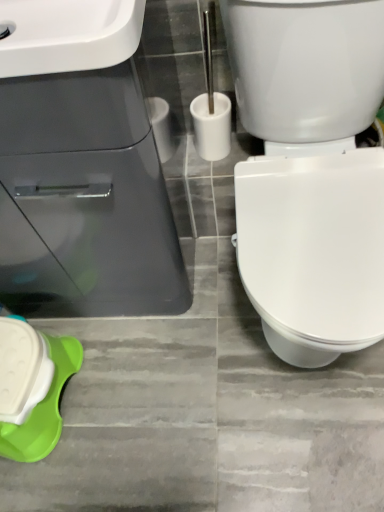
How much space does white glossy sink at upper left, which appears as the 2th sink when viewed from the front, occupy horizontally?

43.48 centimeters.

I want to click on green plastic container at lower left, so click(x=32, y=388).

This screenshot has height=512, width=384. Describe the element at coordinates (313, 251) in the screenshot. I see `white glossy bidet at right` at that location.

The height and width of the screenshot is (512, 384). Identify the location of white glossy bidet at right. (313, 251).

Find the location of `white glossy sink at upper left, which is counted as the 1th sink, starting from the front`. white glossy sink at upper left, which is counted as the 1th sink, starting from the front is located at coordinates (67, 35).

How much distance is there between white plastic toilet brush at center and green plastic container at lower left?

They are 29.18 inches apart.

Is white plastic toilet brush at center positioned far away from green plastic container at lower left?

white plastic toilet brush at center is near green plastic container at lower left, not far away.

Can you tell me how much white plastic toilet brush at center and green plastic container at lower left differ in facing direction?

3.7 degrees separate the facing orientations of white plastic toilet brush at center and green plastic container at lower left.

Which object is wider, white plastic toilet brush at center or green plastic container at lower left?

Wider between the two is green plastic container at lower left.

Is white glossy sink at upper left, the second sink positioned from the back, far from white glossy sink at upper left, which appears as the 2th sink when viewed from the front?

That's not correct — white glossy sink at upper left, the second sink positioned from the back, is a little close to white glossy sink at upper left, which appears as the 2th sink when viewed from the front.

Considering the relative sizes of white glossy sink at upper left, the second sink positioned from the back, and white glossy sink at upper left, which appears as the 2th sink when viewed from the front, in the image provided, is white glossy sink at upper left, the second sink positioned from the back, bigger than white glossy sink at upper left, which appears as the 2th sink when viewed from the front,?

No, white glossy sink at upper left, the second sink positioned from the back, is not bigger than white glossy sink at upper left, which appears as the 2th sink when viewed from the front.

Is white glossy sink at upper left, which is counted as the 1th sink, starting from the front, outside of white glossy sink at upper left, which appears as the 2th sink when viewed from the front?

No, white glossy sink at upper left, which is counted as the 1th sink, starting from the front, is inside white glossy sink at upper left, which appears as the 2th sink when viewed from the front,'s boundary.

Can you confirm if white glossy sink at upper left, which is counted as the 1th sink, starting from the front, is positioned to the left of white glossy sink at upper left, which appears as the 2th sink when viewed from the front?

In fact, white glossy sink at upper left, which is counted as the 1th sink, starting from the front, is to the right of white glossy sink at upper left, which appears as the 2th sink when viewed from the front.

Considering the sizes of objects white glossy sink at upper left, which appears as the 2th sink when viewed from the front, and white plastic toilet brush at center in the image provided, who is taller, white glossy sink at upper left, which appears as the 2th sink when viewed from the front, or white plastic toilet brush at center?

Standing taller between the two is white glossy sink at upper left, which appears as the 2th sink when viewed from the front.

Looking at this image, can you confirm if white glossy sink at upper left, which appears as the 2th sink when viewed from the front, is smaller than white plastic toilet brush at center?

No.

Is the surface of white glossy sink at upper left, which is counted as the 1th sink, starting from the back, in direct contact with white plastic toilet brush at center?

No, white glossy sink at upper left, which is counted as the 1th sink, starting from the back, is not beside white plastic toilet brush at center.

From a real-world perspective, between white plastic toilet brush at center and white glossy bidet at right, who is vertically lower?

white glossy bidet at right, from a real-world perspective.

Find the location of a particular element. The height and width of the screenshot is (512, 384). brush located behind the white glossy bidet at right is located at coordinates (211, 109).

Is white plastic toilet brush at center shorter than white glossy bidet at right?

Correct, white plastic toilet brush at center is not as tall as white glossy bidet at right.

Which object is positioned more to the right, white plastic toilet brush at center or white glossy bidet at right?

Positioned to the right is white glossy bidet at right.

What's the angular difference between white plastic toilet brush at center and white glossy sink at upper left, which appears as the 2th sink when viewed from the front,'s facing directions?

There is a 0.00166-degree angle between the facing directions of white plastic toilet brush at center and white glossy sink at upper left, which appears as the 2th sink when viewed from the front.

Is white plastic toilet brush at center closer to camera compared to white glossy sink at upper left, which appears as the 2th sink when viewed from the front?

No, it is behind white glossy sink at upper left, which appears as the 2th sink when viewed from the front.

From the image's perspective, is white plastic toilet brush at center beneath white glossy sink at upper left, which appears as the 2th sink when viewed from the front?

No.

Does point (220, 122) come behind point (2, 105)?

Yes, it is behind point (2, 105).

Would you say green plastic container at lower left is inside or outside white glossy bidet at right?

green plastic container at lower left exists outside the volume of white glossy bidet at right.

Identify the location of bidet above the green plastic container at lower left (from a real-world perspective). (313, 251).

Who is shorter, green plastic container at lower left or white glossy bidet at right?

green plastic container at lower left is shorter.

Is the depth of green plastic container at lower left greater than that of white glossy bidet at right?

Yes, the depth of green plastic container at lower left is greater than that of white glossy bidet at right.

Between white glossy sink at upper left, the second sink positioned from the back, and white glossy bidet at right, which one has less height?

Standing shorter between the two is white glossy sink at upper left, the second sink positioned from the back.

Is white glossy sink at upper left, which is counted as the 1th sink, starting from the front, inside the boundaries of white glossy bidet at right, or outside?

white glossy sink at upper left, which is counted as the 1th sink, starting from the front, is not enclosed by white glossy bidet at right.

From a real-world perspective, is white glossy sink at upper left, the second sink positioned from the back, beneath white glossy bidet at right?

No.

Locate an element on the screen. The height and width of the screenshot is (512, 384). bidet lying in front of the white glossy sink at upper left, the second sink positioned from the back is located at coordinates (313, 251).

Image resolution: width=384 pixels, height=512 pixels. I want to click on porcelain below the white plastic toilet brush at center (from the image's perspective), so click(x=32, y=388).

Find the location of a particular element. The height and width of the screenshot is (512, 384). sink above the white glossy sink at upper left, which is counted as the 1th sink, starting from the back (from the image's perspective) is located at coordinates (67, 35).

Which object lies further to the anchor point white glossy bidet at right, white glossy sink at upper left, which is counted as the 1th sink, starting from the back, or white plastic toilet brush at center?

Based on the image, white plastic toilet brush at center appears to be further to white glossy bidet at right.

From the image, which object appears to be farther from white plastic toilet brush at center, white glossy sink at upper left, the second sink positioned from the back, or white glossy bidet at right?

white glossy sink at upper left, the second sink positioned from the back, lies further to white plastic toilet brush at center than the other object.

Based on their spatial positions, is white glossy bidet at right or green plastic container at lower left closer to white glossy sink at upper left, which is counted as the 1th sink, starting from the back?

green plastic container at lower left is closer to white glossy sink at upper left, which is counted as the 1th sink, starting from the back.

Estimate the real-world distances between objects in this image. Which object is further from white plastic toilet brush at center, white glossy sink at upper left, the second sink positioned from the back, or green plastic container at lower left?

green plastic container at lower left lies further to white plastic toilet brush at center than the other object.

Based on their spatial positions, is green plastic container at lower left or white glossy bidet at right further from white glossy sink at upper left, which is counted as the 1th sink, starting from the front?

green plastic container at lower left lies further to white glossy sink at upper left, which is counted as the 1th sink, starting from the front, than the other object.

Looking at the image, which one is located closer to green plastic container at lower left, white glossy sink at upper left, which is counted as the 1th sink, starting from the front, or white glossy sink at upper left, which is counted as the 1th sink, starting from the back?

white glossy sink at upper left, which is counted as the 1th sink, starting from the back, is closer to green plastic container at lower left.

In the scene shown: Considering their positions, is green plastic container at lower left positioned further to white glossy sink at upper left, which appears as the 2th sink when viewed from the front, than white glossy bidet at right?

white glossy bidet at right is positioned further to the anchor white glossy sink at upper left, which appears as the 2th sink when viewed from the front.

When comparing their distances from white glossy sink at upper left, which appears as the 2th sink when viewed from the front, does white glossy sink at upper left, the second sink positioned from the back, or white plastic toilet brush at center seem further?

Based on the image, white plastic toilet brush at center appears to be further to white glossy sink at upper left, which appears as the 2th sink when viewed from the front.

This screenshot has height=512, width=384. Identify the location of brush between green plastic container at lower left and white glossy bidet at right in the horizontal direction. (211, 109).

The height and width of the screenshot is (512, 384). I want to click on sink between white glossy sink at upper left, the second sink positioned from the back, and green plastic container at lower left vertically, so (85, 199).

At what (x,y) coordinates should I click in order to perform the action: click on sink between white plastic toilet brush at center and green plastic container at lower left in the up-down direction. Please return your answer as a coordinate pair (x, y). This screenshot has width=384, height=512. Looking at the image, I should click on (85, 199).

The height and width of the screenshot is (512, 384). What are the coordinates of `brush between white glossy sink at upper left, which is counted as the 1th sink, starting from the front, and green plastic container at lower left, in the vertical direction` in the screenshot? It's located at (211, 109).